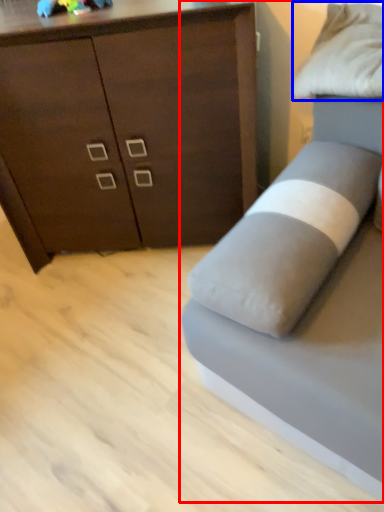
Question: Which object appears farthest to the camera in this image, studio couch (highlighted by a red box) or pillow (highlighted by a blue box)?

Choices:
 (A) studio couch
 (B) pillow

Answer: (B)